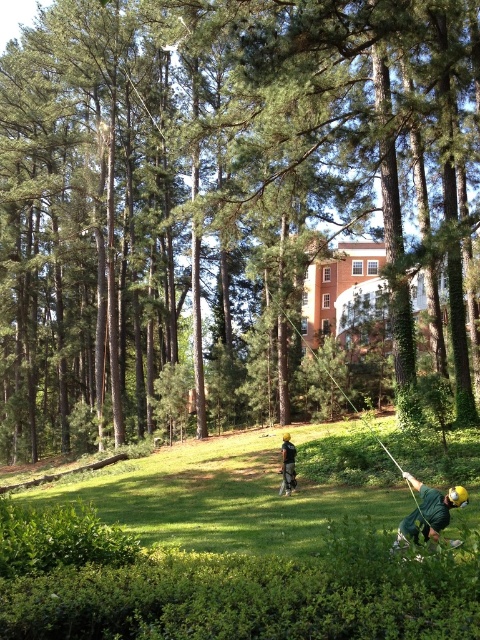
You are standing at the lower center of the image and want to step onto the green grassy area. Based on its location at point coordinates, is the green grassy at lower center directly under your feet?

The green grassy at lower center is located at point coordinates, so yes, it is directly under your feet at the lower center position.

You are a maintenance worker standing on the green grassy at lower center. You need to reach the dark green fabric shirt at center to hand them a tool. Can you throw the tool to them without leaving your position?

The distance between green grassy at lower center and dark green fabric shirt at center is 5.82 meters. If the tool can be thrown that far, then yes, but if not, it might be difficult. However, the question doesn not specify the tool s throwing range, so we can assume it s possible if the worker can throw that distance.

You are a safety inspector checking the work area. You notice the green leafy tree at center and the green matte helmet at center. Which object is larger in size?

The green leafy tree at center is bigger than the green matte helmet at center.